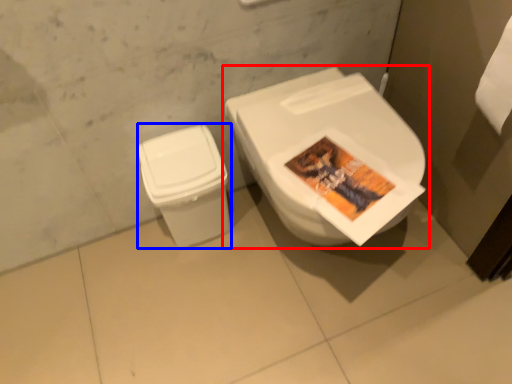
Question: Which object appears farthest to the camera in this image, toilet (highlighted by a red box) or toilet bowl (highlighted by a blue box)?

Choices:
 (A) toilet
 (B) toilet bowl

Answer: (B)